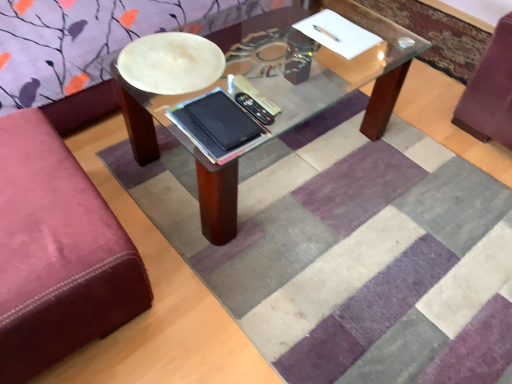
Question: Is black matte tablet at center looking in the opposite direction of velvet maroon ottoman at left?

Choices:
 (A) yes
 (B) no

Answer: (B)

Question: Is black matte tablet at center far away from velvet maroon ottoman at left?

Choices:
 (A) yes
 (B) no

Answer: (B)

Question: Is black matte tablet at center to the right of velvet maroon ottoman at left from the viewer's perspective?

Choices:
 (A) no
 (B) yes

Answer: (B)

Question: Would you say velvet maroon ottoman at left is part of black matte tablet at center's contents?

Choices:
 (A) yes
 (B) no

Answer: (B)

Question: From the image's perspective, is black matte tablet at center on top of velvet maroon ottoman at left?

Choices:
 (A) yes
 (B) no

Answer: (A)

Question: Could you tell me if black matte tablet at center is turned towards velvet maroon ottoman at left?

Choices:
 (A) no
 (B) yes

Answer: (A)

Question: Considering the relative sizes of velvet maroon ottoman at left and striped rug at center in the image provided, is velvet maroon ottoman at left shorter than striped rug at center?

Choices:
 (A) no
 (B) yes

Answer: (A)

Question: From the image's perspective, is velvet maroon ottoman at left on top of striped rug at center?

Choices:
 (A) yes
 (B) no

Answer: (B)

Question: Is velvet maroon ottoman at left at the left side of striped rug at center?

Choices:
 (A) yes
 (B) no

Answer: (A)

Question: Does velvet maroon ottoman at left have a larger size compared to striped rug at center?

Choices:
 (A) yes
 (B) no

Answer: (A)

Question: Is there a large distance between velvet maroon ottoman at left and striped rug at center?

Choices:
 (A) yes
 (B) no

Answer: (B)

Question: From a real-world perspective, is velvet maroon ottoman at left located higher than striped rug at center?

Choices:
 (A) yes
 (B) no

Answer: (A)

Question: Is black matte tablet at center further to the viewer compared to striped rug at center?

Choices:
 (A) no
 (B) yes

Answer: (B)